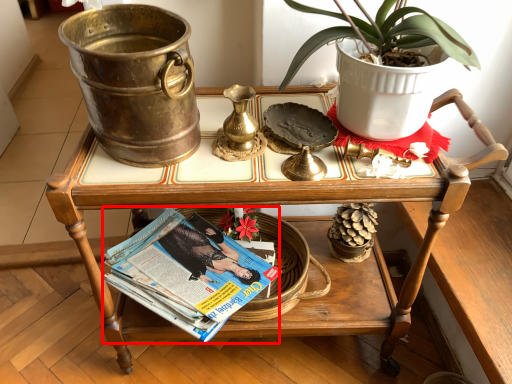
Question: Considering the relative positions of magazine (annotated by the red box) and table in the image provided, where is magazine (annotated by the red box) located with respect to the staircase?

Choices:
 (A) right
 (B) left

Answer: (B)